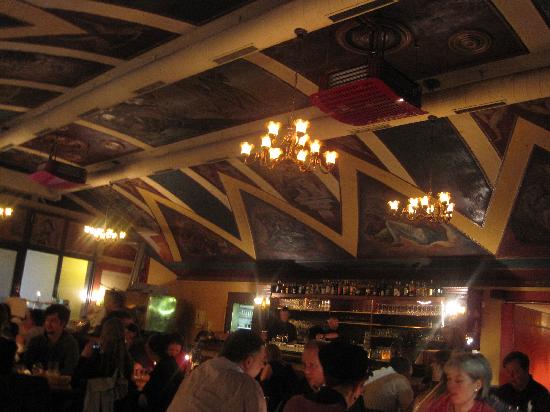
Locate an element on the screen. The height and width of the screenshot is (412, 550). kitchen is located at coordinates (239, 322).